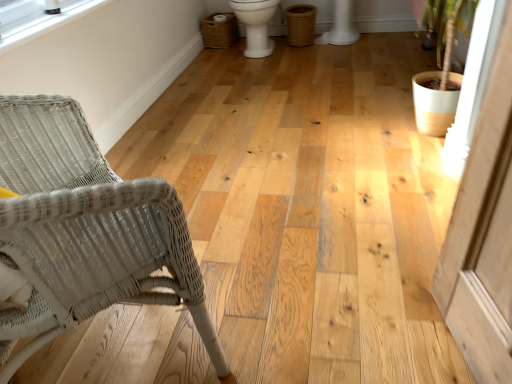
Question: Considering the relative positions of woven brown laundry basket at upper center and white glossy toilet bowl at center in the image provided, is woven brown laundry basket at upper center to the right of white glossy toilet bowl at center from the viewer's perspective?

Choices:
 (A) no
 (B) yes

Answer: (A)

Question: Is woven brown laundry basket at upper center positioned before white glossy toilet bowl at center?

Choices:
 (A) no
 (B) yes

Answer: (A)

Question: From a real-world perspective, is woven brown laundry basket at upper center positioned over white glossy toilet bowl at center based on gravity?

Choices:
 (A) no
 (B) yes

Answer: (A)

Question: From the image's perspective, is woven brown laundry basket at upper center below white glossy toilet bowl at center?

Choices:
 (A) yes
 (B) no

Answer: (B)

Question: Is woven brown laundry basket at upper center oriented towards white glossy toilet bowl at center?

Choices:
 (A) yes
 (B) no

Answer: (B)

Question: Is white wicker chair at left bigger or smaller than clear plastic window screen at upper left?

Choices:
 (A) big
 (B) small

Answer: (A)

Question: From a real-world perspective, relative to clear plastic window screen at upper left, is white wicker chair at left vertically above or below?

Choices:
 (A) above
 (B) below

Answer: (B)

Question: Considering the positions of point [x=80, y=301] and point [x=23, y=19], is point [x=80, y=301] closer or farther from the camera than point [x=23, y=19]?

Choices:
 (A) closer
 (B) farther

Answer: (A)

Question: From the image's perspective, is white wicker chair at left located above or below clear plastic window screen at upper left?

Choices:
 (A) below
 (B) above

Answer: (A)

Question: Is white glossy toilet bowl at center situated inside white wicker chair at left or outside?

Choices:
 (A) outside
 (B) inside

Answer: (A)

Question: Considering their positions, is white glossy toilet bowl at center located in front of or behind white wicker chair at left?

Choices:
 (A) behind
 (B) front

Answer: (A)

Question: From the image's perspective, is white glossy toilet bowl at center located above or below white wicker chair at left?

Choices:
 (A) above
 (B) below

Answer: (A)

Question: From a real-world perspective, is white glossy toilet bowl at center physically located above or below white wicker chair at left?

Choices:
 (A) above
 (B) below

Answer: (B)

Question: Looking at their shapes, would you say woven brown laundry basket at upper center is wider or thinner than white wicker chair at left?

Choices:
 (A) wide
 (B) thin

Answer: (B)

Question: Is woven brown laundry basket at upper center inside the boundaries of white wicker chair at left, or outside?

Choices:
 (A) inside
 (B) outside

Answer: (B)